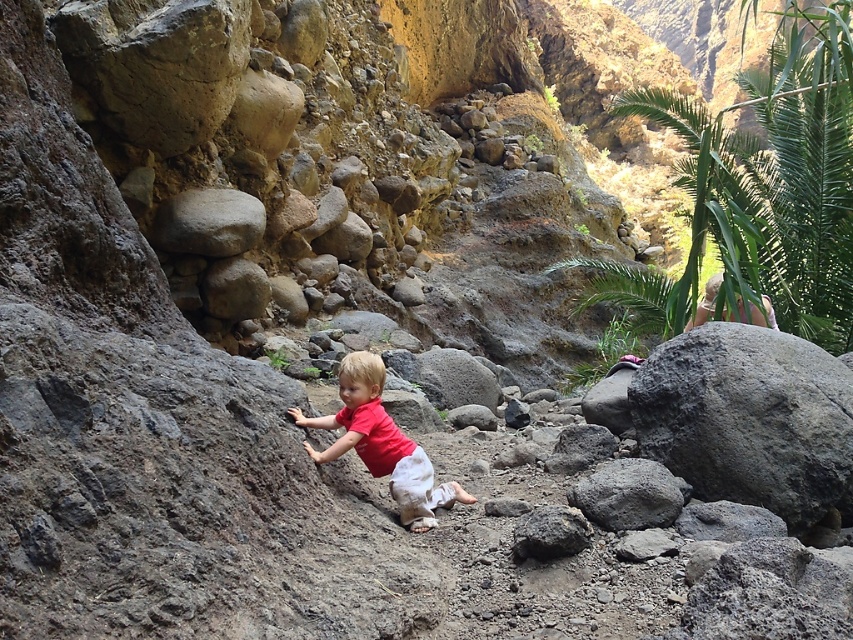
Question: Which object is farther from the camera taking this photo?

Choices:
 (A) gray rough rock at upper center
 (B) matte red shirt at center
 (C) gray rough rock at center

Answer: (A)

Question: Which object is the closest to the volcanic rock boulder at right?

Choices:
 (A) gray rough rock at upper center
 (B) matte red shirt at center
 (C) gray rough rock at center

Answer: (C)

Question: Is volcanic rock boulder at right to the right of gray rough rock at center from the viewer's perspective?

Choices:
 (A) yes
 (B) no

Answer: (A)

Question: Which point is farther from the camera taking this photo?

Choices:
 (A) (804, 420)
 (B) (402, 486)
 (C) (512, 547)

Answer: (A)

Question: Can you confirm if volcanic rock boulder at right is wider than gray rough rock at center?

Choices:
 (A) no
 (B) yes

Answer: (B)

Question: Can you confirm if volcanic rock boulder at right is positioned above gray rough rock at center?

Choices:
 (A) no
 (B) yes

Answer: (B)